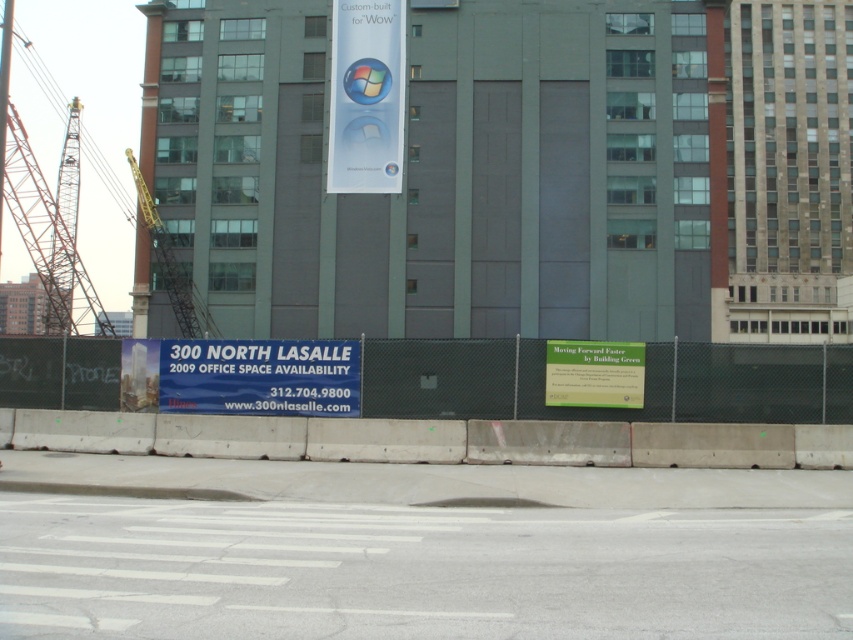
Question: Can you confirm if metallic gray crane at left is positioned above yellow metallic crane at upper left?

Choices:
 (A) no
 (B) yes

Answer: (B)

Question: Which point is farther to the camera?

Choices:
 (A) (189, 304)
 (B) (634, 401)
 (C) (376, 163)
 (D) (41, 228)

Answer: (C)

Question: Is metallic gray crane at left wider than yellow metallic crane at upper left?

Choices:
 (A) yes
 (B) no

Answer: (A)

Question: Does green paper sign at center appear on the right side of yellow metallic crane at upper left?

Choices:
 (A) yes
 (B) no

Answer: (A)

Question: Which object appears closest to the camera in this image?

Choices:
 (A) metallic gray crane at left
 (B) yellow metallic crane at upper left

Answer: (A)

Question: Which object is farther from the camera taking this photo?

Choices:
 (A) green paper sign at center
 (B) yellow metallic crane at upper left

Answer: (B)